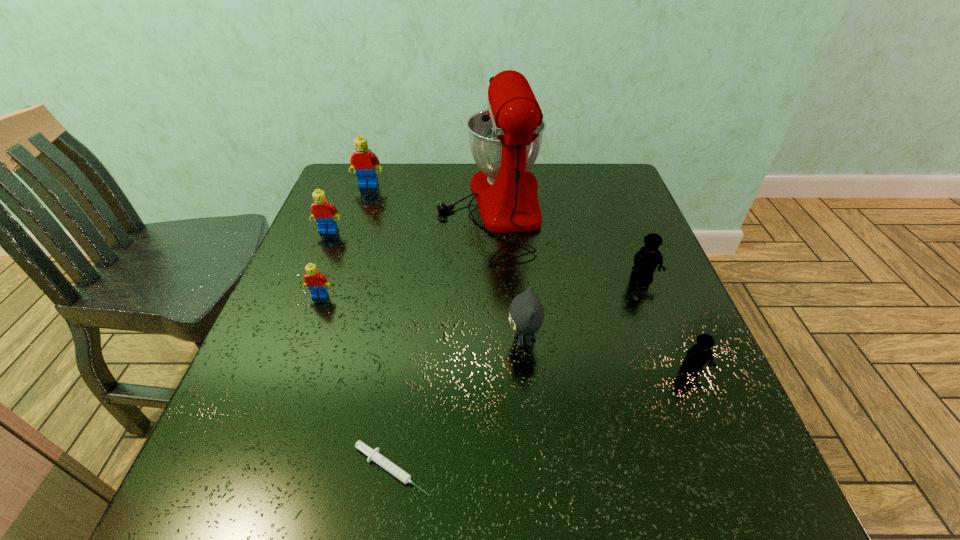
You are a GUI agent. You are given a task and a screenshot of the screen. Output one action in this format:
    pyautogui.click(x=<x>, y=<y>)
    Task: Click on the mixer
    The height and width of the screenshot is (540, 960).
    Given the screenshot: What is the action you would take?
    pyautogui.click(x=505, y=139)

Find the location of a particular element. red mixer is located at coordinates (505, 139).

At what (x,y) coordinates should I click in order to perform the action: click on the tallest Lego. Please return your answer as a coordinate pair (x, y). Looking at the image, I should click on (363, 161).

Where is `the farthest Lego`? the farthest Lego is located at coordinates (363, 161).

What are the coordinates of `the second biggest red Lego` in the screenshot? It's located at (x=325, y=213).

Locate an element on the screen. The image size is (960, 540). the second farthest Lego is located at coordinates (325, 213).

Locate an element on the screen. the third farthest Lego is located at coordinates (646, 260).

This screenshot has height=540, width=960. What are the coordinates of `the fourth farthest object` in the screenshot? It's located at (646, 260).

The width and height of the screenshot is (960, 540). In order to click on kitten in this screenshot , I will do `click(526, 313)`.

Identify the location of the nearest Lego. (700, 353).